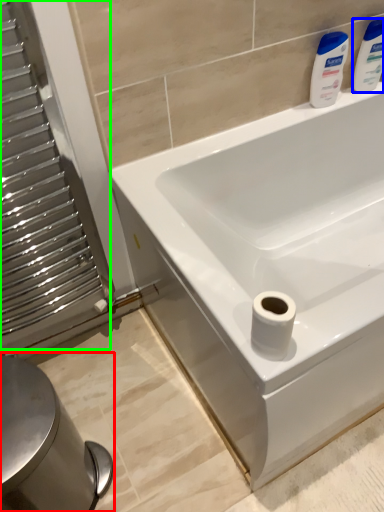
Question: Which object is positioned farthest from bidet (highlighted by a red box)? Select from cleaning product (highlighted by a blue box) and screen door (highlighted by a green box).

Choices:
 (A) cleaning product
 (B) screen door

Answer: (A)